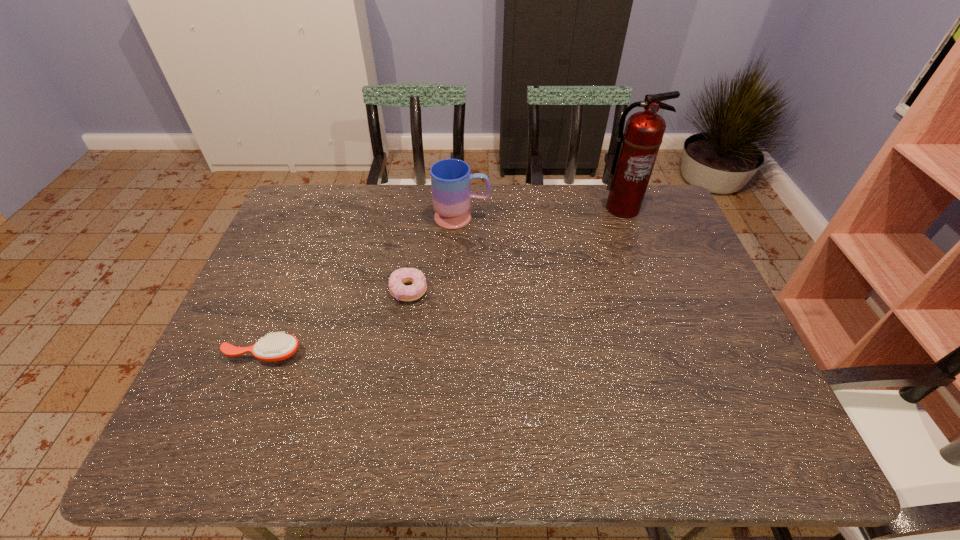
Locate an element on the screen. free spot between the doughnut and the leftmost object is located at coordinates (336, 322).

Find the location of a particular element. empty space that is in between the doughnut and the rightmost object is located at coordinates (516, 249).

Identify which object is the second closest to the third farthest object. Please provide its 2D coordinates. Your answer should be formatted as a tuple, i.e. [(x, y)], where the tuple contains the x and y coordinates of a point satisfying the conditions above.

[(278, 346)]

Choose which object is the nearest neighbor to the hairbrush. Please provide its 2D coordinates. Your answer should be formatted as a tuple, i.e. [(x, y)], where the tuple contains the x and y coordinates of a point satisfying the conditions above.

[(397, 289)]

At what (x,y) coordinates should I click in order to perform the action: click on vacant space that satisfies the following two spatial constraints: 1. on the nozzle side of the rightmost object; 2. on the side of the mug with the handle. Please return your answer as a coordinate pair (x, y). Looking at the image, I should click on [625, 218].

Locate an element on the screen. free point that satisfies the following two spatial constraints: 1. on the side of the third shortest object with the handle; 2. on the front side of the doughnut is located at coordinates (459, 291).

At what (x,y) coordinates should I click in order to perform the action: click on free space that satisfies the following two spatial constraints: 1. on the nozzle side of the fire extinguisher; 2. on the side of the second tallest object with the handle. Please return your answer as a coordinate pair (x, y). This screenshot has height=540, width=960. Looking at the image, I should click on (625, 218).

At what (x,y) coordinates should I click in order to perform the action: click on vacant point that satisfies the following two spatial constraints: 1. on the back side of the second nearest object; 2. on the right side of the hairbrush. Please return your answer as a coordinate pair (x, y). Looking at the image, I should click on (289, 291).

Locate an element on the screen. The height and width of the screenshot is (540, 960). vacant area that satisfies the following two spatial constraints: 1. on the side of the third shortest object with the handle; 2. on the front side of the leftmost object is located at coordinates (456, 353).